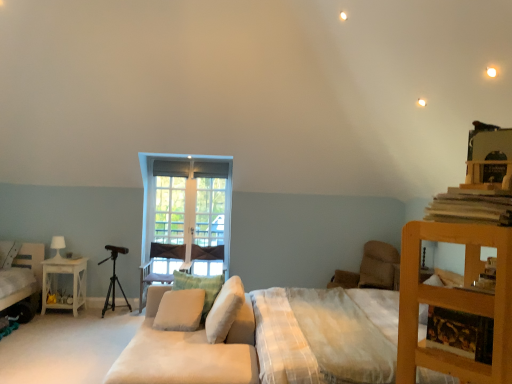
Question: From a real-world perspective, is wooden tripod at left physically below beige fabric pillow at center, positioned as the 3th pillow in left-to-right order?

Choices:
 (A) yes
 (B) no

Answer: (A)

Question: Can you confirm if wooden tripod at left is thinner than beige fabric pillow at center, arranged as the second pillow when viewed from the right?

Choices:
 (A) yes
 (B) no

Answer: (B)

Question: Is wooden tripod at left oriented towards beige fabric pillow at center, the third pillow positioned from the front?

Choices:
 (A) yes
 (B) no

Answer: (B)

Question: Would you say wooden tripod at left is outside beige fabric pillow at center, which is the second pillow in back-to-front order?

Choices:
 (A) no
 (B) yes

Answer: (B)

Question: Does wooden tripod at left touch beige fabric pillow at center, arranged as the second pillow when viewed from the right?

Choices:
 (A) no
 (B) yes

Answer: (A)

Question: In terms of width, does white soft cushion at center, the 4th pillow viewed from the back, look wider or thinner when compared to white glossy nightstand at left?

Choices:
 (A) thin
 (B) wide

Answer: (A)

Question: In terms of size, does white soft cushion at center, which is counted as the first pillow, starting from the right, appear bigger or smaller than white glossy nightstand at left?

Choices:
 (A) big
 (B) small

Answer: (B)

Question: From a real-world perspective, is white soft cushion at center, the 4th pillow viewed from the back, physically located above or below white glossy nightstand at left?

Choices:
 (A) below
 (B) above

Answer: (B)

Question: From the image's perspective, is white soft cushion at center, marked as the 4th pillow in a left-to-right arrangement, above or below white glossy nightstand at left?

Choices:
 (A) above
 (B) below

Answer: (A)

Question: Relative to soft beige fabric couch at center, is velvet purple armchair at center, the 1th armchair when ordered from left to right, in front or behind?

Choices:
 (A) behind
 (B) front

Answer: (A)

Question: Is point (142, 283) positioned closer to the camera than point (184, 345)?

Choices:
 (A) closer
 (B) farther

Answer: (B)

Question: Is velvet purple armchair at center, which appears as the second armchair when viewed from the right, taller or shorter than soft beige fabric couch at center?

Choices:
 (A) tall
 (B) short

Answer: (A)

Question: Considering the positions of velvet purple armchair at center, which appears as the second armchair when viewed from the right, and soft beige fabric couch at center in the image, is velvet purple armchair at center, which appears as the second armchair when viewed from the right, wider or thinner than soft beige fabric couch at center?

Choices:
 (A) thin
 (B) wide

Answer: (A)

Question: In the image, is wooden tripod at left on the left side or the right side of white soft cushion at center, arranged as the 3th pillow when viewed from the back?

Choices:
 (A) left
 (B) right

Answer: (A)

Question: Is wooden tripod at left in front of or behind white soft cushion at center, the 2th pillow positioned from the left, in the image?

Choices:
 (A) front
 (B) behind

Answer: (B)